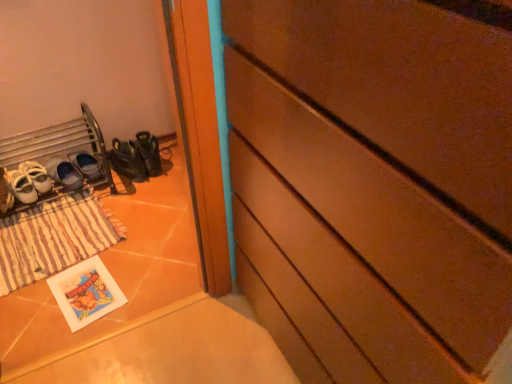
Question: Is brown striped mat at lower left bigger than matte black shoes at lower left, the first footwear when ordered from right to left?

Choices:
 (A) no
 (B) yes

Answer: (B)

Question: Does brown striped mat at lower left contain matte black shoes at lower left, the first footwear when ordered from right to left?

Choices:
 (A) no
 (B) yes

Answer: (A)

Question: Is brown striped mat at lower left positioned beyond the bounds of matte black shoes at lower left, the first footwear when ordered from right to left?

Choices:
 (A) no
 (B) yes

Answer: (B)

Question: From a real-world perspective, does brown striped mat at lower left sit lower than matte black shoes at lower left, the first footwear when ordered from right to left?

Choices:
 (A) no
 (B) yes

Answer: (B)

Question: From the image's perspective, is brown striped mat at lower left over matte black shoes at lower left, which is counted as the 4th footwear, starting from the left?

Choices:
 (A) yes
 (B) no

Answer: (B)

Question: From the image's perspective, is white leather shoes at left, which is counted as the first footwear, starting from the left, above or below brown striped mat at lower left?

Choices:
 (A) above
 (B) below

Answer: (A)

Question: Would you say white leather shoes at left, which is counted as the first footwear, starting from the left, is inside or outside brown striped mat at lower left?

Choices:
 (A) inside
 (B) outside

Answer: (B)

Question: In terms of width, does white leather shoes at left, which is counted as the first footwear, starting from the left, look wider or thinner when compared to brown striped mat at lower left?

Choices:
 (A) wide
 (B) thin

Answer: (B)

Question: From a real-world perspective, relative to brown striped mat at lower left, is white leather shoes at left, the fourth footwear from the right, vertically above or below?

Choices:
 (A) above
 (B) below

Answer: (A)

Question: From a real-world perspective, relative to matte black shoes at lower left, which is counted as the 4th footwear, starting from the left, is brown striped mat at lower left vertically above or below?

Choices:
 (A) above
 (B) below

Answer: (B)

Question: Looking at their shapes, would you say brown striped mat at lower left is wider or thinner than matte black shoes at lower left, which is counted as the 4th footwear, starting from the left?

Choices:
 (A) thin
 (B) wide

Answer: (B)

Question: Relative to matte black shoes at lower left, the first footwear when ordered from right to left, is brown striped mat at lower left in front or behind?

Choices:
 (A) front
 (B) behind

Answer: (A)

Question: Is brown striped mat at lower left spatially inside matte black shoes at lower left, which is counted as the 4th footwear, starting from the left, or outside of it?

Choices:
 (A) inside
 (B) outside

Answer: (B)

Question: Relative to green rubber boots at lower left, is white leather shoes at left, the fourth footwear from the right, in front or behind?

Choices:
 (A) front
 (B) behind

Answer: (A)

Question: Considering the positions of white leather shoes at left, which is counted as the first footwear, starting from the left, and green rubber boots at lower left in the image, is white leather shoes at left, which is counted as the first footwear, starting from the left, taller or shorter than green rubber boots at lower left?

Choices:
 (A) tall
 (B) short

Answer: (B)